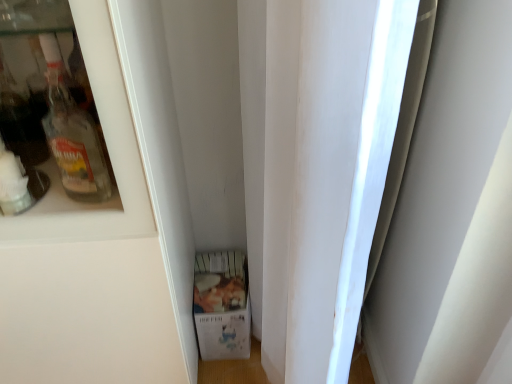
Describe the element at coordinates (222, 305) in the screenshot. I see `white cardboard box at center` at that location.

Where is `white cardboard box at center`? white cardboard box at center is located at coordinates (222, 305).

Based on the photo, measure the distance between point (205,277) and camera.

The depth of point (205,277) is 4.16 feet.

Where is `white cardboard box at center`? This screenshot has width=512, height=384. white cardboard box at center is located at coordinates (222, 305).